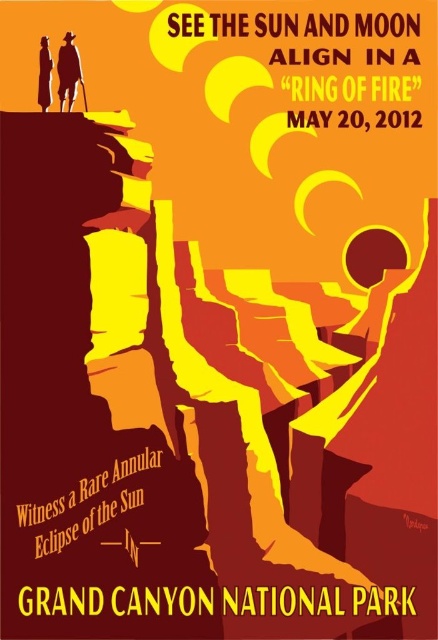
Is matte brown hat at upper left taller than matte black figure at upper left?

Yes, matte brown hat at upper left is taller than matte black figure at upper left.

Who is positioned more to the right, matte brown hat at upper left or matte black figure at upper left?

Positioned to the right is matte brown hat at upper left.

Is point (66, 45) farther from camera compared to point (42, 74)?

No, it is not.

Where is `matte brown hat at upper left`? The image size is (438, 640). matte brown hat at upper left is located at coordinates (69, 72).